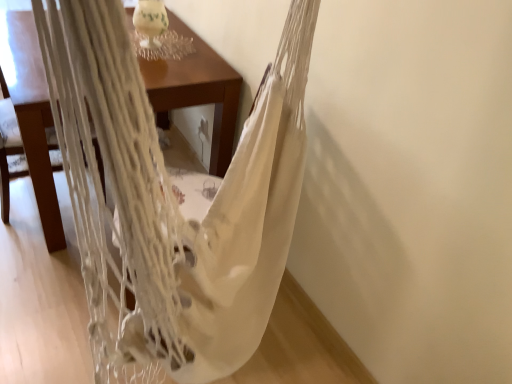
Question: From a real-world perspective, is white macrame hammock at center above or below white woven hammock at upper left?

Choices:
 (A) above
 (B) below

Answer: (A)

Question: Considering the positions of white macrame hammock at center and white woven hammock at upper left in the image, is white macrame hammock at center taller or shorter than white woven hammock at upper left?

Choices:
 (A) tall
 (B) short

Answer: (A)

Question: Which is farther from the wooden table at center?

Choices:
 (A) white macrame hammock at center
 (B) white woven hammock at upper left

Answer: (B)

Question: Based on their relative distances, which object is nearer to the wooden table at center?

Choices:
 (A) white macrame hammock at center
 (B) white woven hammock at upper left

Answer: (A)